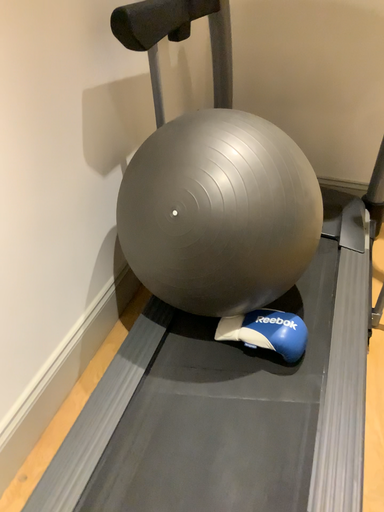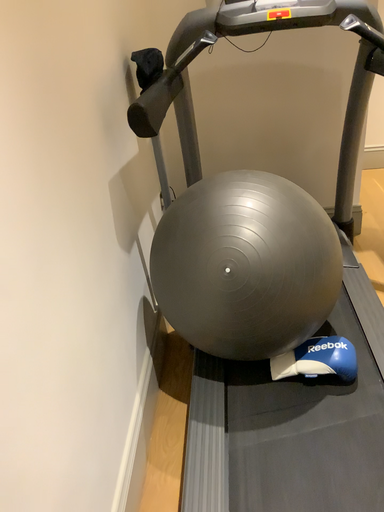
Question: How did the camera likely rotate when shooting the video?

Choices:
 (A) rotated right
 (B) rotated left

Answer: (A)